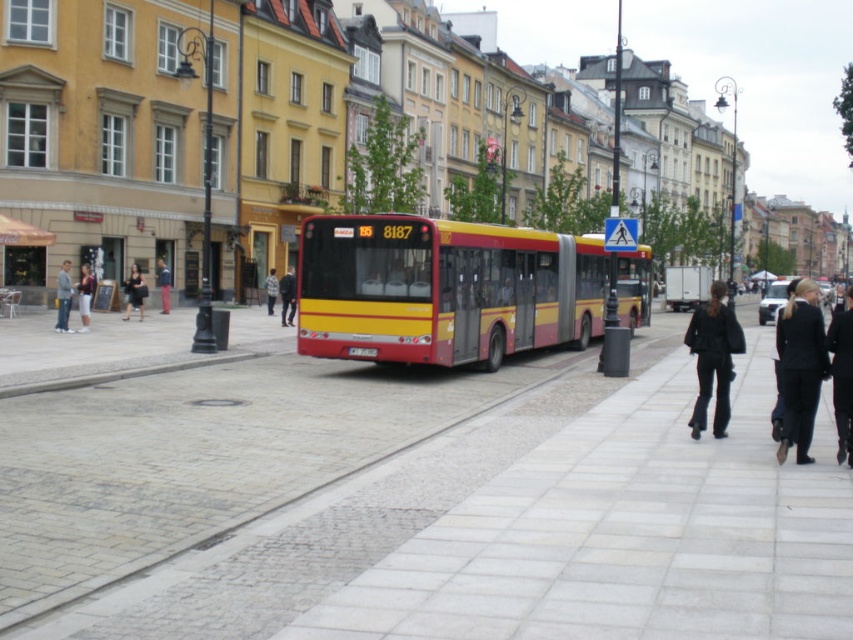
Question: Which point is closer to the camera?

Choices:
 (A) (86, 317)
 (B) (743, 339)
 (C) (61, 282)

Answer: (B)

Question: Does black leather coat at lower right appear on the right side of light brown leather jacket at center?

Choices:
 (A) yes
 (B) no

Answer: (A)

Question: Can you confirm if black leather coat at lower right is positioned to the left of denim jacket at left?

Choices:
 (A) no
 (B) yes

Answer: (A)

Question: Among these objects, which one is nearest to the camera?

Choices:
 (A) light brown leather jacket at center
 (B) smooth concrete pavement at center

Answer: (B)

Question: Among these points, which one is farthest from the camera?

Choices:
 (A) (70, 330)
 (B) (166, 310)
 (C) (13, 221)

Answer: (B)

Question: Does black leather coat at lower right have a lesser width compared to black fabric bag at left?

Choices:
 (A) yes
 (B) no

Answer: (B)